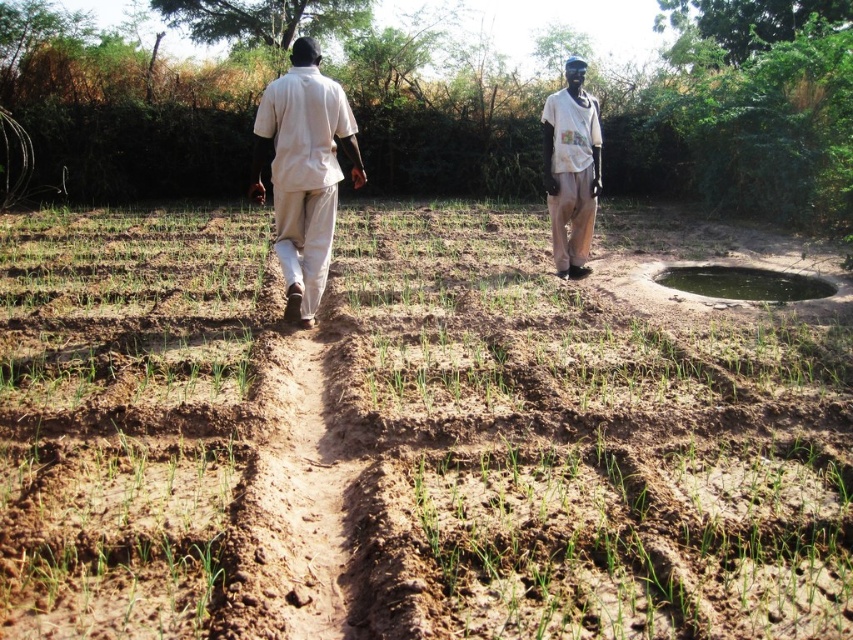
You are a farmer in the field and need to check the soil condition. Which object in the scene is larger in size between the brown soil at center and the white cotton shirt at upper center?

The brown soil at center is bigger than the white cotton shirt at upper center according to the description.